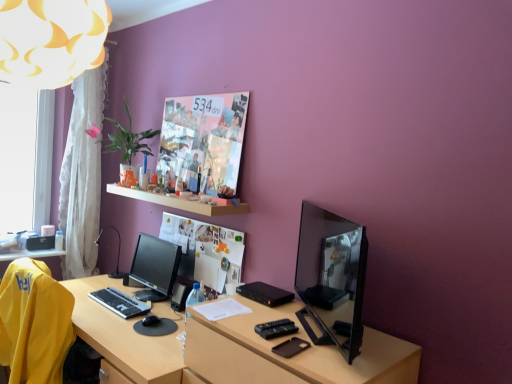
Question: Is yellow fabric chair at lower left aimed at transparent glass window at left?

Choices:
 (A) yes
 (B) no

Answer: (B)

Question: Can you see yellow fabric chair at lower left touching transparent glass window at left?

Choices:
 (A) yes
 (B) no

Answer: (B)

Question: Can we say yellow fabric chair at lower left lies outside transparent glass window at left?

Choices:
 (A) no
 (B) yes

Answer: (B)

Question: From a real-world perspective, is yellow fabric chair at lower left physically below transparent glass window at left?

Choices:
 (A) yes
 (B) no

Answer: (A)

Question: From the image's perspective, is yellow fabric chair at lower left beneath transparent glass window at left?

Choices:
 (A) no
 (B) yes

Answer: (B)

Question: From a real-world perspective, relative to yellow fabric chair at lower left, is shiny black monitor at right, the 1th computer monitor from the front, vertically above or below?

Choices:
 (A) above
 (B) below

Answer: (A)

Question: In the image, is shiny black monitor at right, the 2th computer monitor positioned from the left, on the left side or the right side of yellow fabric chair at lower left?

Choices:
 (A) left
 (B) right

Answer: (B)

Question: Which is correct: shiny black monitor at right, the 2th computer monitor positioned from the left, is inside yellow fabric chair at lower left, or outside of it?

Choices:
 (A) outside
 (B) inside

Answer: (A)

Question: In the image, is shiny black monitor at right, acting as the second computer monitor starting from the back, positioned in front of or behind yellow fabric chair at lower left?

Choices:
 (A) behind
 (B) front

Answer: (B)

Question: Considering the positions of white wooden shelf at upper center and black plastic table lamp at left in the image, is white wooden shelf at upper center taller or shorter than black plastic table lamp at left?

Choices:
 (A) short
 (B) tall

Answer: (A)

Question: Would you say white wooden shelf at upper center is to the left or to the right of black plastic table lamp at left in the picture?

Choices:
 (A) left
 (B) right

Answer: (B)

Question: Considering the positions of point (242, 210) and point (119, 236), is point (242, 210) closer or farther from the camera than point (119, 236)?

Choices:
 (A) closer
 (B) farther

Answer: (A)

Question: From a real-world perspective, is white wooden shelf at upper center positioned above or below black plastic table lamp at left?

Choices:
 (A) above
 (B) below

Answer: (A)

Question: Would you say white sheer curtain at left is inside or outside shiny black monitor at right, the 1th computer monitor from the front?

Choices:
 (A) inside
 (B) outside

Answer: (B)

Question: Is white sheer curtain at left to the left or to the right of shiny black monitor at right, arranged as the first computer monitor when viewed from the right, in the image?

Choices:
 (A) left
 (B) right

Answer: (A)